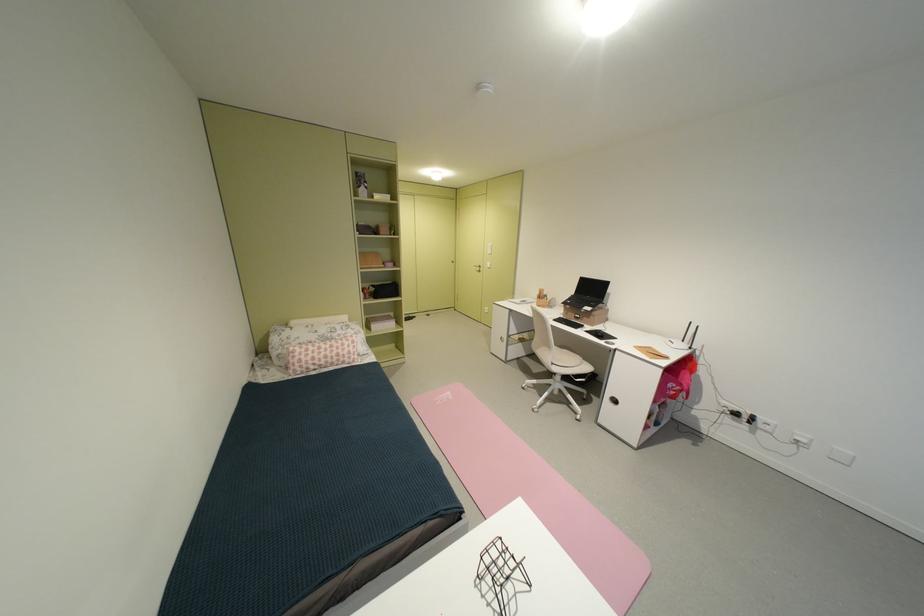
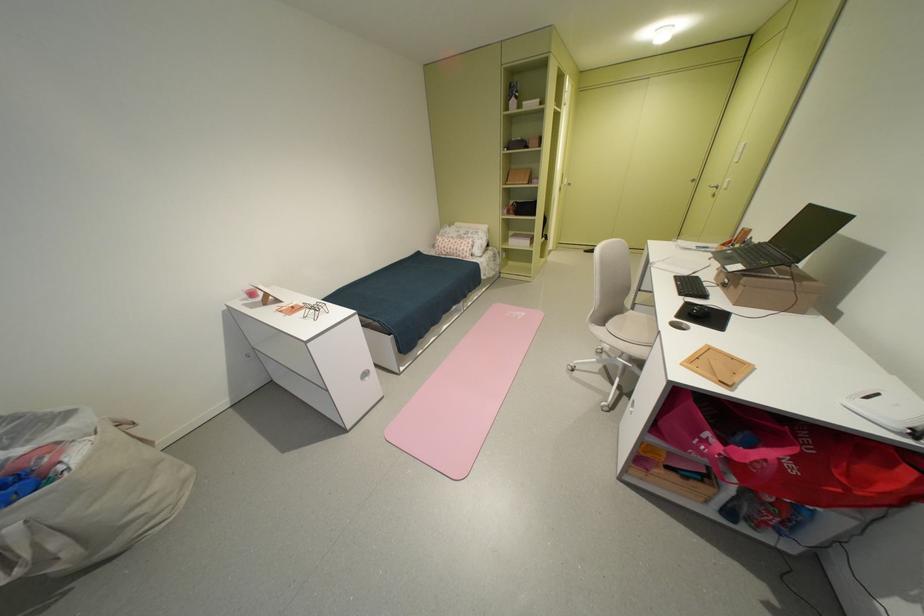
Find the pixel in the second image that matches [563,363] in the first image.

(615, 326)